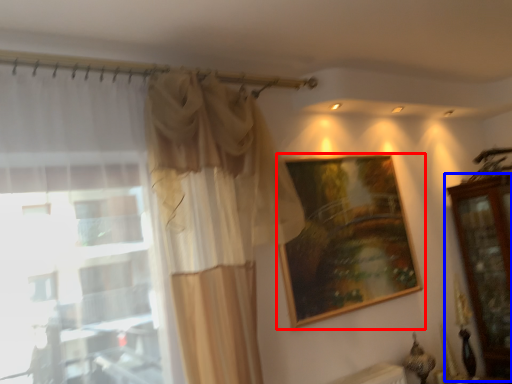
Question: Which point is closer to the camera, picture frame (highlighted by a red box) or dresser (highlighted by a blue box)?

Choices:
 (A) picture frame
 (B) dresser

Answer: (A)